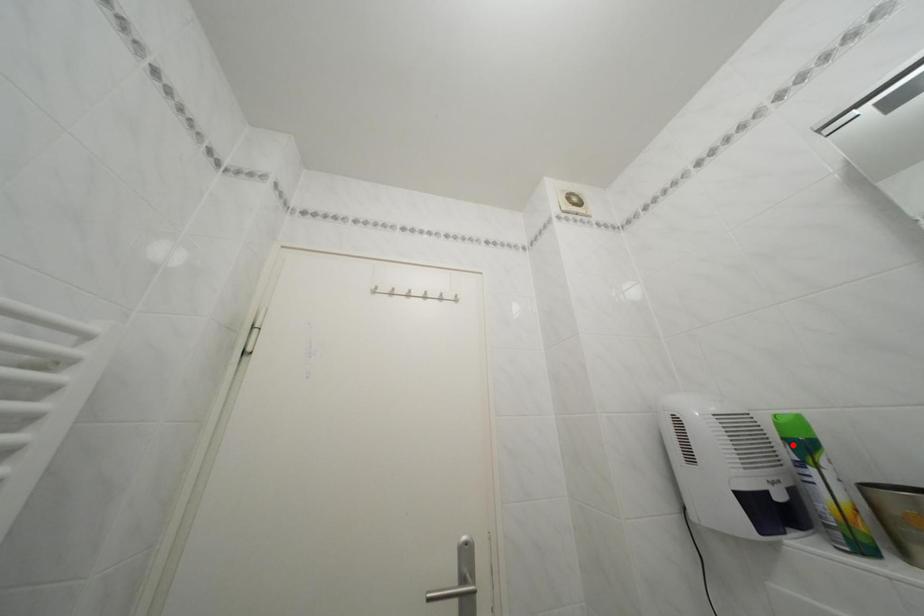
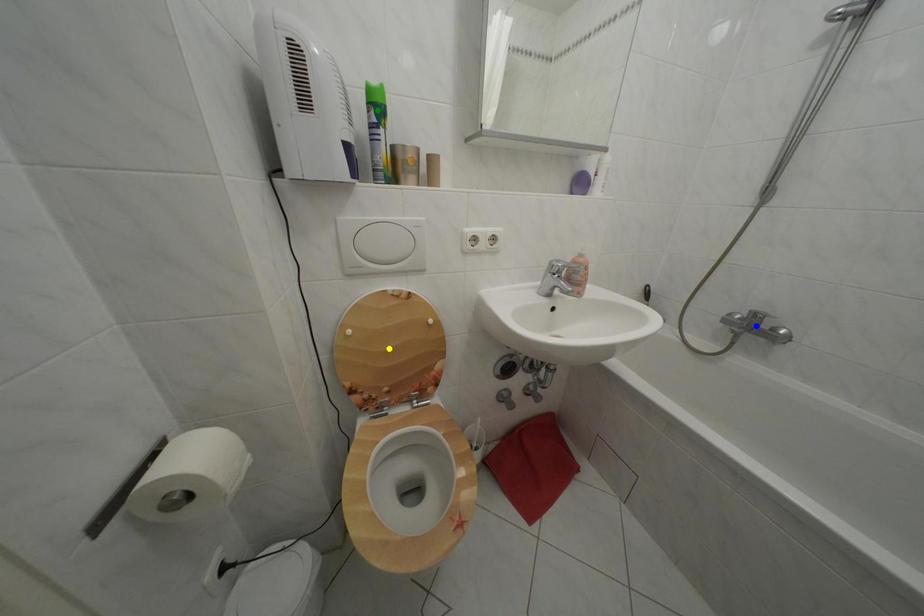
Question: I am providing you with two images of the same scene from different viewpoints. A red point is marked on the first image. You are given multiple points on the second image. In image 2, which mark is for the same physical point as the one in image 1?

Choices:
 (A) yellow point
 (B) blue point
 (C) green point

Answer: (C)